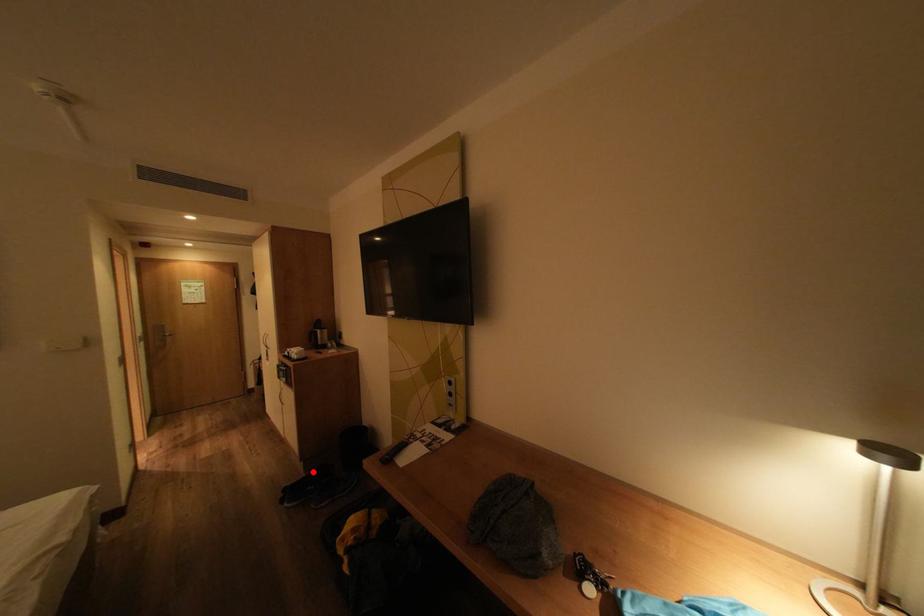
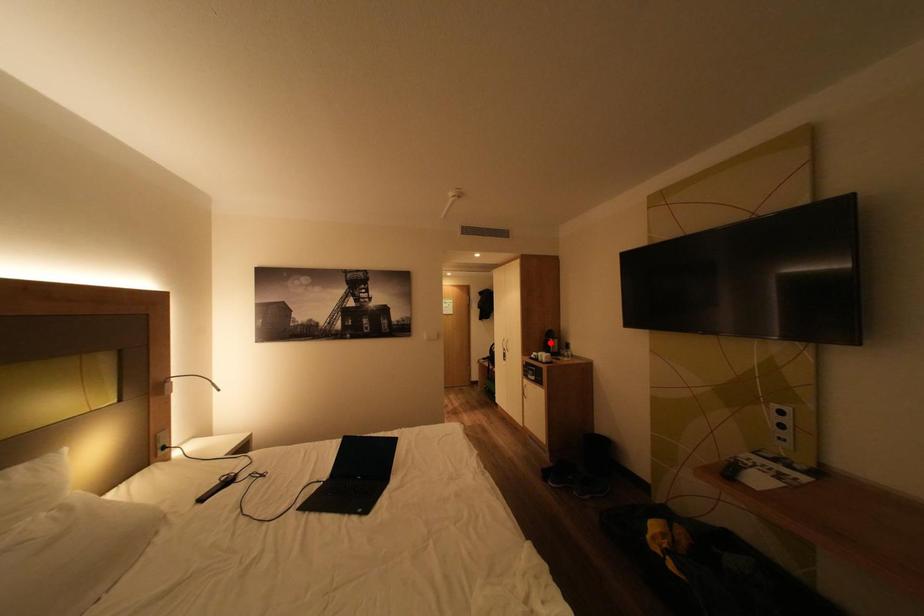
I am providing you with two images of the same scene from different viewpoints. A red point is marked on the first image and another point is marked on the second image. Does the point marked in image1 correspond to the same location as the one in image2?

No